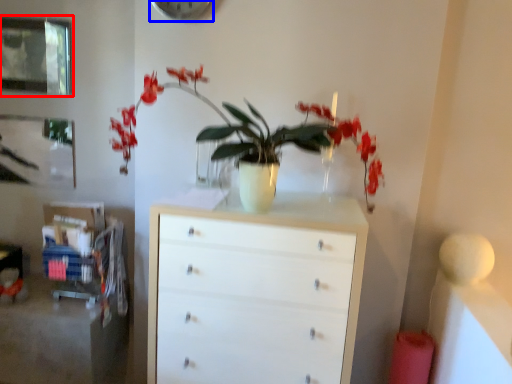
Question: Among these objects, which one is nearest to the camera, picture frame (highlighted by a red box) or clock (highlighted by a blue box)?

Choices:
 (A) picture frame
 (B) clock

Answer: (B)